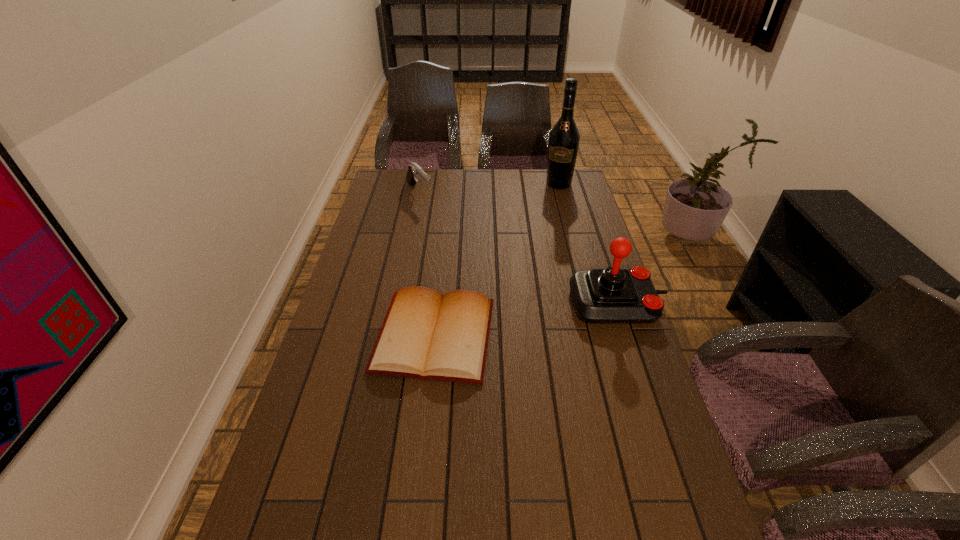
What are the coordinates of `free space on the desktop that is between the Bible and the third shortest object and is positioned on the label of the wine bottle` in the screenshot? It's located at (502, 323).

Find the location of a particular element. The image size is (960, 540). vacant spot on the desktop that is between the shortest object and the joystick and is positioned at the muzzle of the second shortest object is located at coordinates (549, 315).